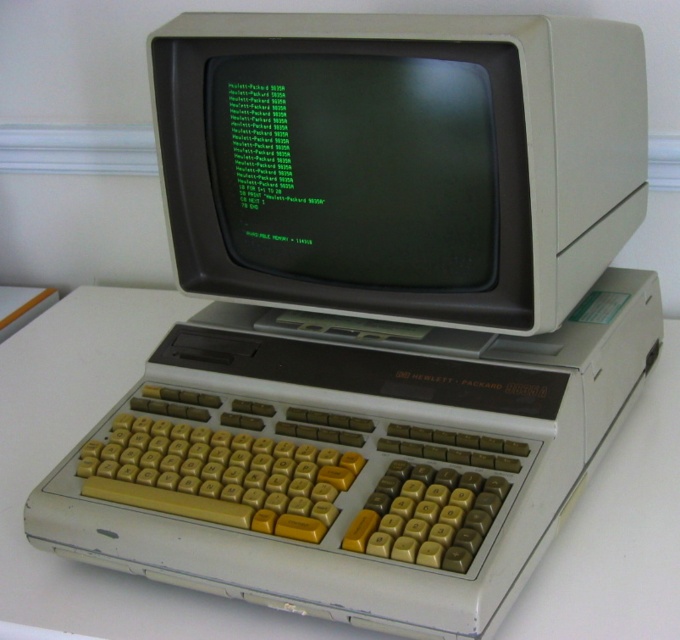
Question: Which of the following is the closest to the observer?

Choices:
 (A) beige plastic monitor at center
 (B) green matte monitor at center

Answer: (A)

Question: Is beige plastic monitor at center to the right of green matte monitor at center from the viewer's perspective?

Choices:
 (A) yes
 (B) no

Answer: (A)

Question: Is beige plastic monitor at center further to the viewer compared to green matte monitor at center?

Choices:
 (A) no
 (B) yes

Answer: (A)

Question: Can you confirm if beige plastic monitor at center is positioned to the left of green matte monitor at center?

Choices:
 (A) no
 (B) yes

Answer: (A)

Question: Which point is closer to the camera?

Choices:
 (A) beige plastic monitor at center
 (B) green matte monitor at center

Answer: (A)

Question: Which point is closer to the camera?

Choices:
 (A) (256, 131)
 (B) (333, 19)

Answer: (B)